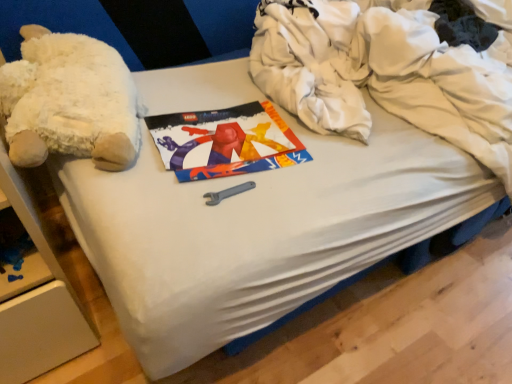
Locate an element on the screen. This screenshot has width=512, height=384. white plush at left is located at coordinates (69, 101).

The image size is (512, 384). Describe the element at coordinates (69, 101) in the screenshot. I see `white plush at left` at that location.

Measure the distance between point [15,66] and camera.

Point [15,66] and camera are 84.50 centimeters apart.

You are a GUI agent. You are given a task and a screenshot of the screen. Output one action in this format:
    pyautogui.click(x=<x>, y=<y>)
    Task: Click on the white cotton clothing at upper right
    This screenshot has height=384, width=512.
    Given the screenshot: What is the action you would take?
    pyautogui.click(x=393, y=68)

The height and width of the screenshot is (384, 512). Describe the element at coordinates (393, 68) in the screenshot. I see `white cotton clothing at upper right` at that location.

The image size is (512, 384). Find the location of `white plush at left`. white plush at left is located at coordinates (69, 101).

Visually, is white cotton clothing at upper right positioned to the left or to the right of white plush at left?

white cotton clothing at upper right is positioned on white plush at left's right side.

In the image, is white cotton clothing at upper right positioned in front of or behind white plush at left?

In the image, white cotton clothing at upper right appears in front of white plush at left.

Between point (367, 0) and point (105, 50), which one is positioned in front?

Point (105, 50)

From the image's perspective, which one is positioned lower, white cotton clothing at upper right or white plush at left?

white plush at left appears lower in the image.

From a real-world perspective, which object stands above the other?

white plush at left.

Is white cotton clothing at upper right wider than white plush at left?

Indeed, white cotton clothing at upper right has a greater width compared to white plush at left.

Considering the relative sizes of white cotton clothing at upper right and white plush at left in the image provided, is white cotton clothing at upper right shorter than white plush at left?

Incorrect, the height of white cotton clothing at upper right does not fall short of that of white plush at left.

Based on their sizes in the image, would you say white cotton clothing at upper right is bigger or smaller than white plush at left?

In the image, white cotton clothing at upper right appears to be larger than white plush at left.

Would you say white cotton clothing at upper right is inside or outside white plush at left?

white cotton clothing at upper right cannot be found inside white plush at left.

Are white cotton clothing at upper right and white plush at left making contact?

No.

Is white plush at left at the back of white cotton clothing at upper right?

No.

Find the location of a particular element. The height and width of the screenshot is (384, 512). teddy bear behind the white cotton clothing at upper right is located at coordinates (69, 101).

Which object is positioned more to the left, white plush at left or white cotton clothing at upper right?

From the viewer's perspective, white plush at left appears more on the left side.

Is the position of white plush at left more distant than that of white cotton clothing at upper right?

That is True.

Considering the positions of point (113, 126) and point (353, 36), is point (113, 126) closer or farther from the camera than point (353, 36)?

Point (113, 126) is positioned closer to the camera compared to point (353, 36).

From the image's perspective, which is above, white plush at left or white cotton clothing at upper right?

From the image's view, white cotton clothing at upper right is above.

From a real-world perspective, between white plush at left and white cotton clothing at upper right, who is vertically higher?

In real-world perspective, white plush at left is above.

Considering the sizes of objects white plush at left and white cotton clothing at upper right in the image provided, who is thinner, white plush at left or white cotton clothing at upper right?

white plush at left is thinner.

Considering the sizes of objects white plush at left and white cotton clothing at upper right in the image provided, who is taller, white plush at left or white cotton clothing at upper right?

white cotton clothing at upper right.

Which of these two, white plush at left or white cotton clothing at upper right, is bigger?

white cotton clothing at upper right.

Could white cotton clothing at upper right be considered to be inside white plush at left?

Definitely not — white cotton clothing at upper right is not inside white plush at left.

Would you consider white plush at left to be distant from white cotton clothing at upper right?

white plush at left is near white cotton clothing at upper right, not far away.

Is white plush at left turned away from white cotton clothing at upper right?

No, white plush at left's orientation is not away from white cotton clothing at upper right.

What's the angular difference between white plush at left and white cotton clothing at upper right's facing directions?

The angle between the facing direction of white plush at left and the facing direction of white cotton clothing at upper right is 3.94 degrees.

In the image, there is a white cotton clothing at upper right. Where is `teddy bear below it (from the image's perspective)`? This screenshot has height=384, width=512. teddy bear below it (from the image's perspective) is located at coordinates pyautogui.click(x=69, y=101).

Image resolution: width=512 pixels, height=384 pixels. In order to click on teddy bear that is below the white cotton clothing at upper right (from the image's perspective) in this screenshot , I will do `click(69, 101)`.

The image size is (512, 384). Find the location of `teddy bear that appears on the left of white cotton clothing at upper right`. teddy bear that appears on the left of white cotton clothing at upper right is located at coordinates (69, 101).